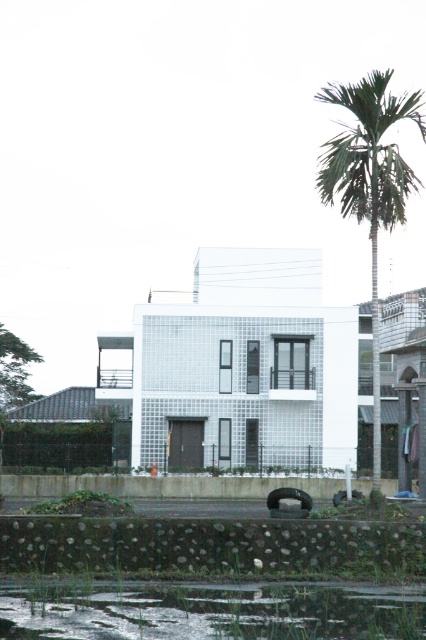
Question: Which object appears farthest from the camera in this image?

Choices:
 (A) green leafy palm tree at right
 (B) clear water at lower center

Answer: (A)

Question: Is clear water at lower center wider than green leafy palm tree at right?

Choices:
 (A) yes
 (B) no

Answer: (B)

Question: Is clear water at lower center below green leafy palm tree at right?

Choices:
 (A) no
 (B) yes

Answer: (B)

Question: Which point is farther from the camera taking this photo?

Choices:
 (A) (330, 148)
 (B) (420, 612)

Answer: (A)

Question: Among these objects, which one is farthest from the camera?

Choices:
 (A) clear water at lower center
 (B) green leafy palm tree at right

Answer: (B)

Question: Can you confirm if clear water at lower center is bigger than green leafy palm tree at right?

Choices:
 (A) yes
 (B) no

Answer: (B)